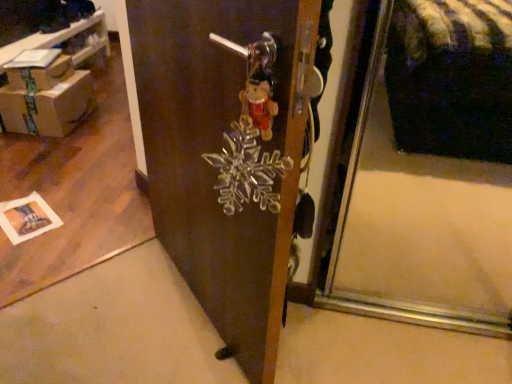
Where is `free region on the left part of transparent glass snowflake at center`? The height and width of the screenshot is (384, 512). free region on the left part of transparent glass snowflake at center is located at coordinates (109, 309).